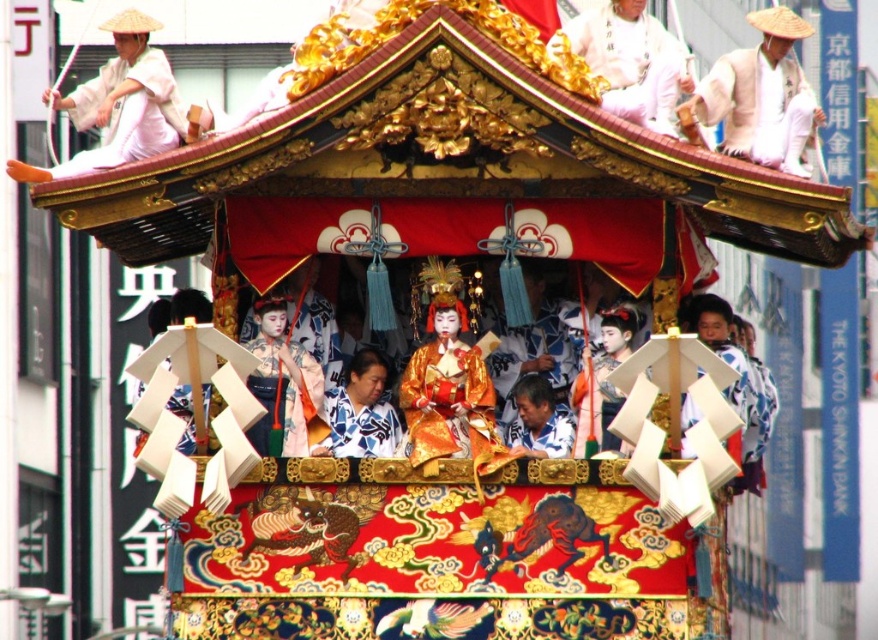
You are standing in front of the float and want to touch both points on it. Which point should you reach for first, point A at coordinates point (282, 316) or point B at coordinates point (534, 429)?

You should reach for point A at coordinates point (282, 316) first because it is closer to you than point B at coordinates point (534, 429).

Looking at the float from the front, which object is positioned to the right of the other between the white cotton hat at upper right and the matte pink kimono at center?

The white cotton hat at upper right is positioned to the right of the matte pink kimono at center.

You are an event planner organizing a photo shoot on the float. You need to place two props, one for each of the two central figures wearing the matte pink kimono at center and the matte white shirt at center. Which figure should you give the larger prop to ensure it doesn not overwhelm their outfit?

The matte white shirt at center should receive the larger prop because the matte pink kimono at center occupies less space, so a larger prop might overwhelm it, whereas the matte white shirt at center has more space and can accommodate a larger prop without appearing disproportionate.